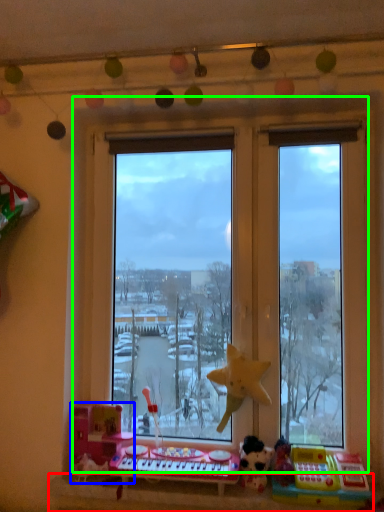
Question: Which object is positioned farthest from window sill (highlighted by a red box)? Select from toy (highlighted by a blue box) and window (highlighted by a green box).

Choices:
 (A) toy
 (B) window

Answer: (B)